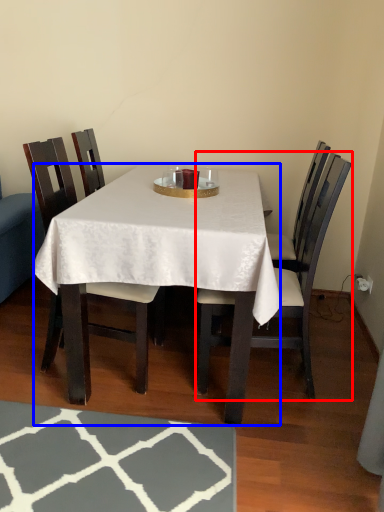
Question: Which object is closer to the camera taking this photo, chair (highlighted by a red box) or desk (highlighted by a blue box)?

Choices:
 (A) chair
 (B) desk

Answer: (B)